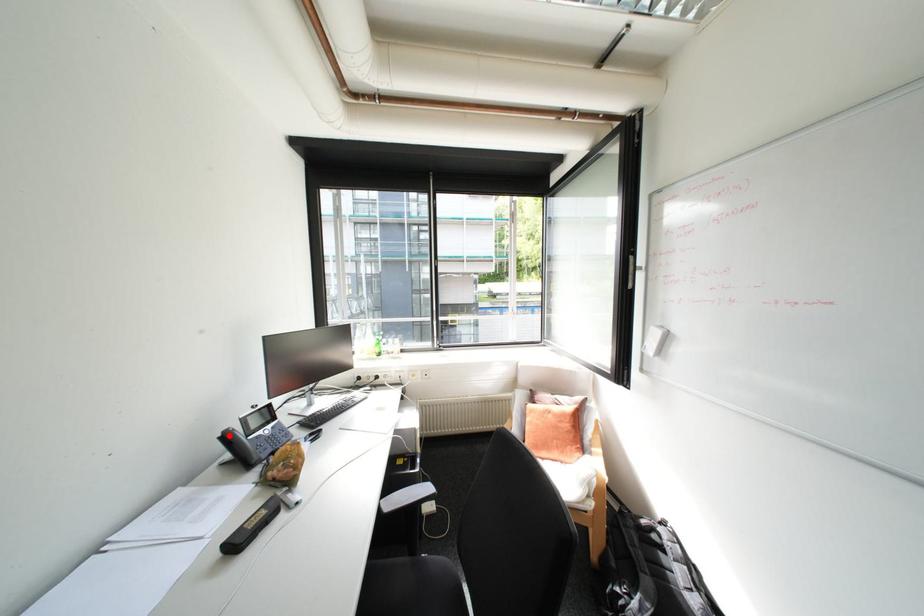
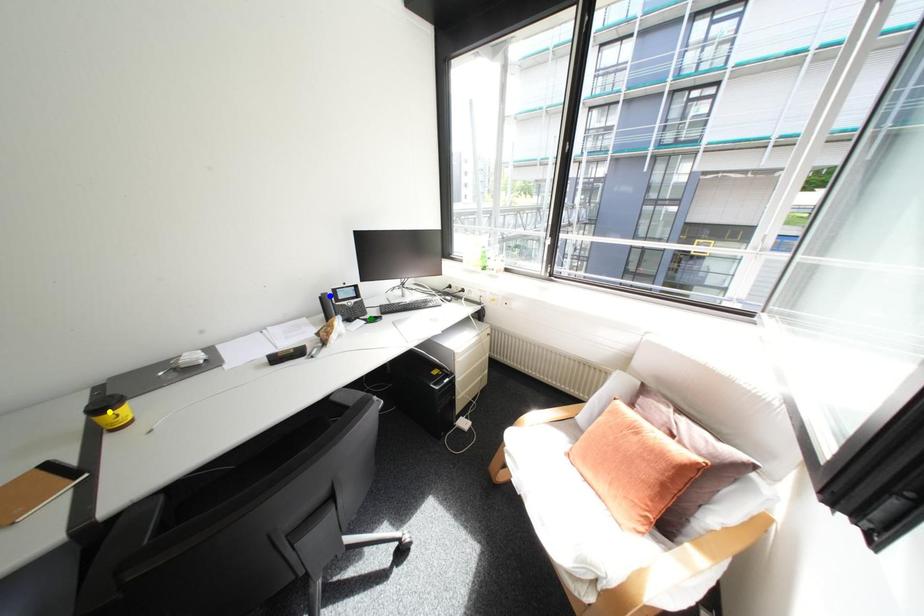
Question: I am providing you with two images of the same scene from different viewpoints. A red point is marked on the first image. You are given multiple points on the second image. Which point in image 2 represents the same 3d spot as the red point in image 1?

Choices:
 (A) yellow point
 (B) blue point
 (C) green point

Answer: (B)